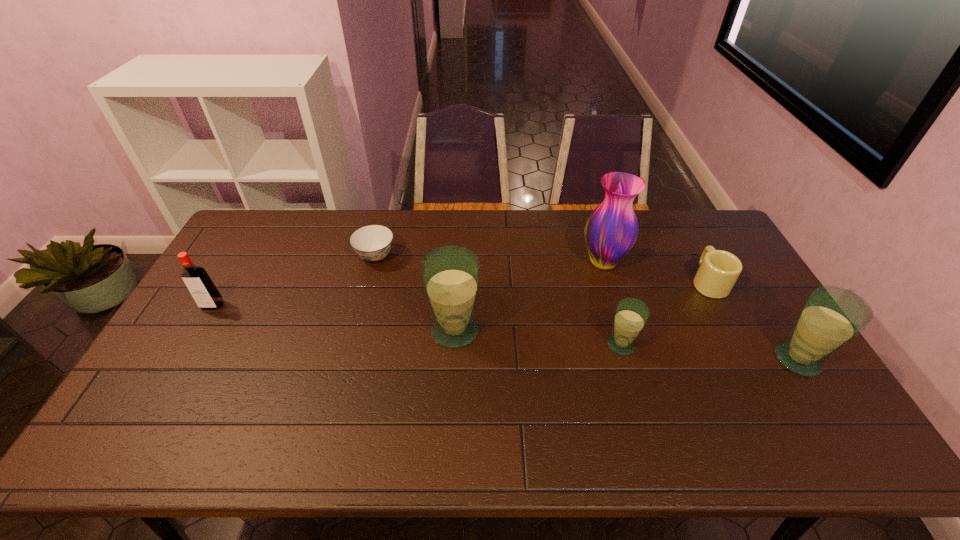
Locate an element on the screen. the third object from left to right is located at coordinates (451, 275).

The height and width of the screenshot is (540, 960). Find the location of `the shortest glass`. the shortest glass is located at coordinates (631, 315).

Identify the location of the fifth tallest object. This screenshot has height=540, width=960. (631, 315).

What are the coordinates of `the second shortest glass` in the screenshot? It's located at (831, 316).

Locate an element on the screen. the rightmost object is located at coordinates (831, 316).

Locate an element on the screen. This screenshot has height=540, width=960. the tallest object is located at coordinates (611, 230).

What are the coordinates of `the second shortest object` in the screenshot? It's located at (719, 270).

You are a GUI agent. You are given a task and a screenshot of the screen. Output one action in this format:
    pyautogui.click(x=<x>, y=<y>)
    Task: Click on the sixth object from left to right
    The height and width of the screenshot is (540, 960).
    Given the screenshot: What is the action you would take?
    pyautogui.click(x=719, y=270)

Where is `soup bowl`? The image size is (960, 540). soup bowl is located at coordinates (372, 243).

I want to click on the sixth object from right to left, so (372, 243).